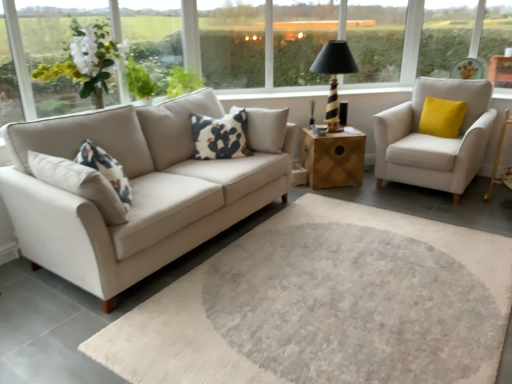
Question: Can you confirm if white matte flower at upper left is bigger than black and white printed pillow at center, which appears as the 1th pillow when viewed from the front?

Choices:
 (A) yes
 (B) no

Answer: (A)

Question: Is white matte flower at upper left wider than black and white printed pillow at center, the 2th pillow when ordered from back to front?

Choices:
 (A) yes
 (B) no

Answer: (A)

Question: Does white matte flower at upper left touch black and white printed pillow at center, which appears as the 1th pillow when viewed from the front?

Choices:
 (A) no
 (B) yes

Answer: (A)

Question: Is white matte flower at upper left to the left of black and white printed pillow at center, the second pillow positioned from the right, from the viewer's perspective?

Choices:
 (A) yes
 (B) no

Answer: (A)

Question: Is white matte flower at upper left located outside black and white printed pillow at center, the second pillow positioned from the right?

Choices:
 (A) no
 (B) yes

Answer: (B)

Question: From the image's perspective, is wooden side table at center located above or below black striped wood table lamp at upper center?

Choices:
 (A) below
 (B) above

Answer: (A)

Question: In the image, is wooden side table at center positioned in front of or behind black striped wood table lamp at upper center?

Choices:
 (A) behind
 (B) front

Answer: (A)

Question: In terms of height, does wooden side table at center look taller or shorter compared to black striped wood table lamp at upper center?

Choices:
 (A) short
 (B) tall

Answer: (A)

Question: Which is correct: wooden side table at center is inside black striped wood table lamp at upper center, or outside of it?

Choices:
 (A) outside
 (B) inside

Answer: (A)

Question: Looking at their shapes, would you say yellow velvet pillow at right, the second pillow viewed from the front, is wider or thinner than black striped wood table lamp at upper center?

Choices:
 (A) wide
 (B) thin

Answer: (B)

Question: From their relative heights in the image, would you say yellow velvet pillow at right, placed as the 1th pillow when sorted from right to left, is taller or shorter than black striped wood table lamp at upper center?

Choices:
 (A) tall
 (B) short

Answer: (B)

Question: From a real-world perspective, is yellow velvet pillow at right, placed as the 1th pillow when sorted from right to left, physically located above or below black striped wood table lamp at upper center?

Choices:
 (A) above
 (B) below

Answer: (B)

Question: In the image, is yellow velvet pillow at right, the second pillow viewed from the front, on the left side or the right side of black striped wood table lamp at upper center?

Choices:
 (A) right
 (B) left

Answer: (A)

Question: Is white fabric armchair at right spatially inside black striped wood table lamp at upper center, or outside of it?

Choices:
 (A) outside
 (B) inside

Answer: (A)

Question: In terms of width, does white fabric armchair at right look wider or thinner when compared to black striped wood table lamp at upper center?

Choices:
 (A) wide
 (B) thin

Answer: (A)